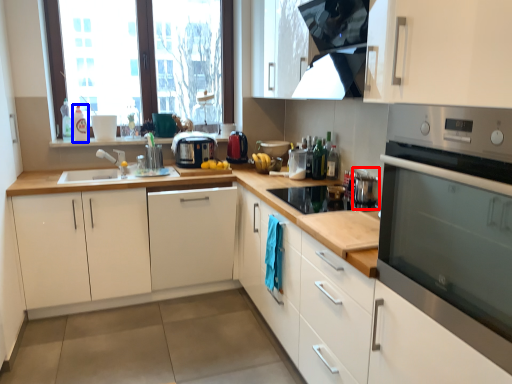
Question: Which object appears farthest to the camera in this image, appliance (highlighted by a red box) or bottle (highlighted by a blue box)?

Choices:
 (A) appliance
 (B) bottle

Answer: (B)